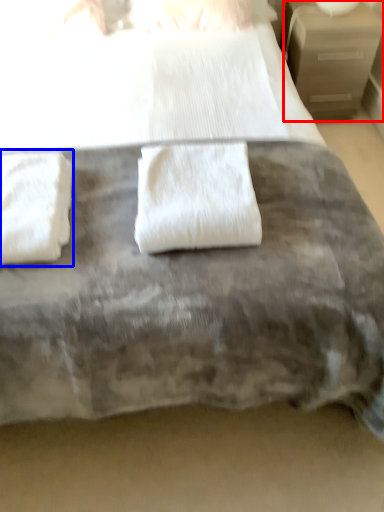
Question: Which point is further to the camera, nightstand (highlighted by a red box) or towel (highlighted by a blue box)?

Choices:
 (A) nightstand
 (B) towel

Answer: (A)